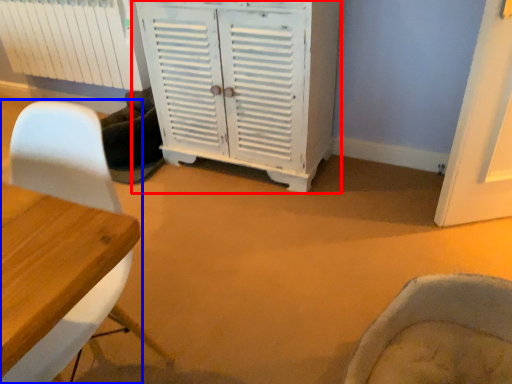
Question: Which object appears closest to the camera in this image, cabinetry (highlighted by a red box) or chair (highlighted by a blue box)?

Choices:
 (A) cabinetry
 (B) chair

Answer: (B)